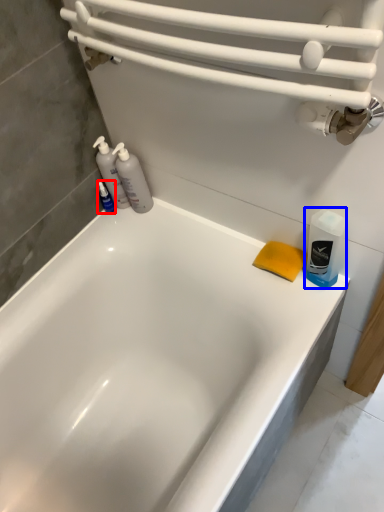
Question: Which object appears closest to the camera in this image, toiletry (highlighted by a red box) or cleaning product (highlighted by a blue box)?

Choices:
 (A) toiletry
 (B) cleaning product

Answer: (B)